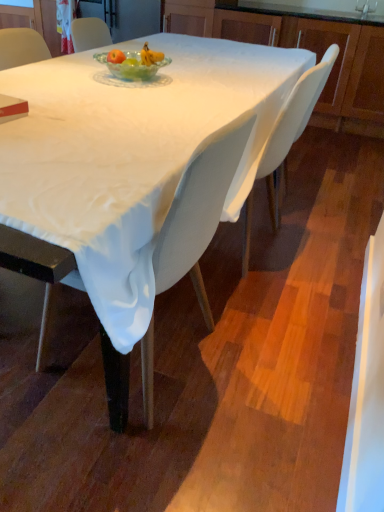
Locate an element on the screen. This screenshot has width=384, height=512. free spot behind translucent glass bowl at center is located at coordinates (156, 66).